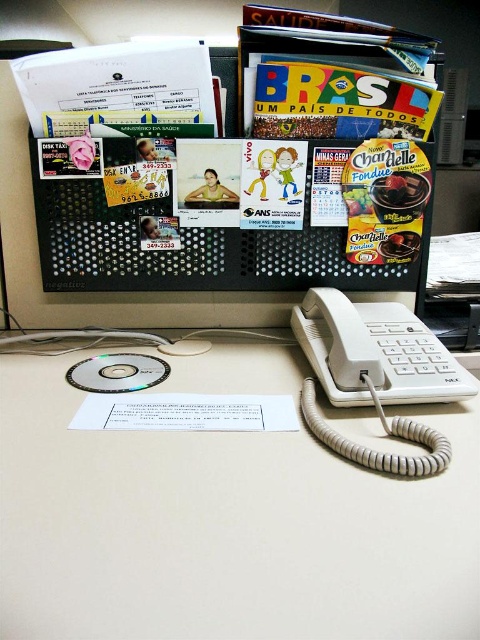
Can you confirm if white plastic desk at center is positioned above white plastic phone at center?

No.

Does white plastic desk at center have a larger size compared to white plastic phone at center?

Indeed, white plastic desk at center has a larger size compared to white plastic phone at center.

This screenshot has width=480, height=640. I want to click on white plastic desk at center, so click(224, 518).

Where is `white plastic desk at center`? The image size is (480, 640). white plastic desk at center is located at coordinates click(224, 518).

Is white plastic phone at center positioned in front of transparent plastic cd at center?

Yes, white plastic phone at center is closer to the viewer.

Is white plastic phone at center further to the viewer compared to transparent plastic cd at center?

No, it is in front of transparent plastic cd at center.

Who is more forward, (x=424, y=460) or (x=137, y=387)?

Positioned in front is point (x=424, y=460).

Find the location of a particular element. The width and height of the screenshot is (480, 640). white plastic phone at center is located at coordinates (375, 374).

Identify the location of white plastic desk at center. (224, 518).

Consider the image. How far apart are white plastic desk at center and transparent plastic cd at center?

7.58 inches

You are a GUI agent. You are given a task and a screenshot of the screen. Output one action in this format:
    pyautogui.click(x=<x>, y=<y>)
    Task: Click on the white plastic desk at center
    Image resolution: width=480 pixels, height=640 pixels.
    Given the screenshot: What is the action you would take?
    pyautogui.click(x=224, y=518)